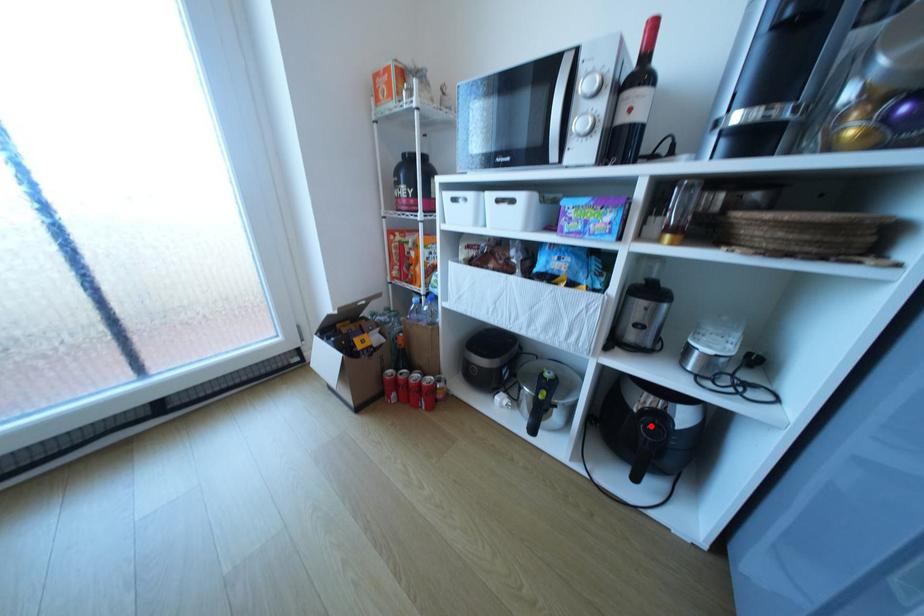
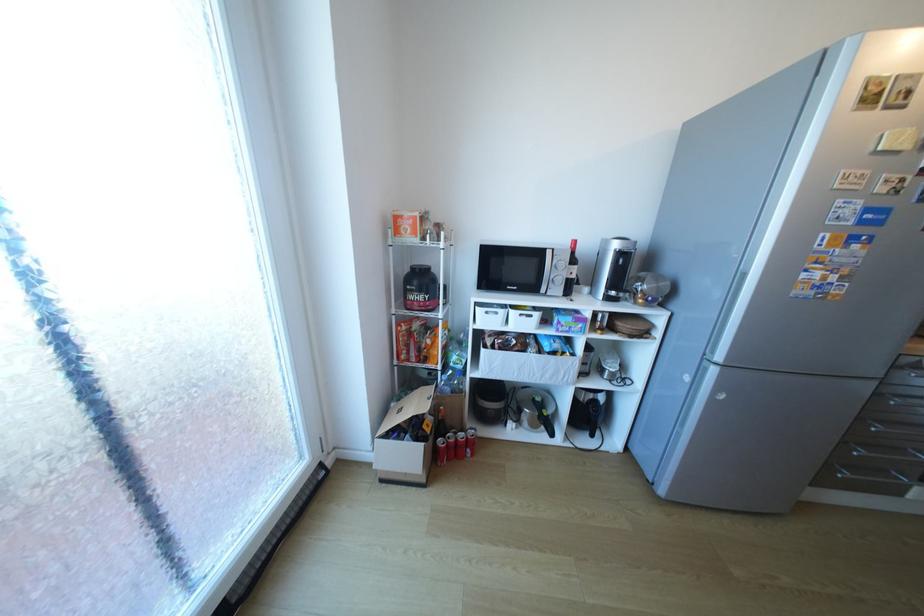
The point at the highlighted location is marked in the first image. Where is the corresponding point in the second image?

(600, 408)